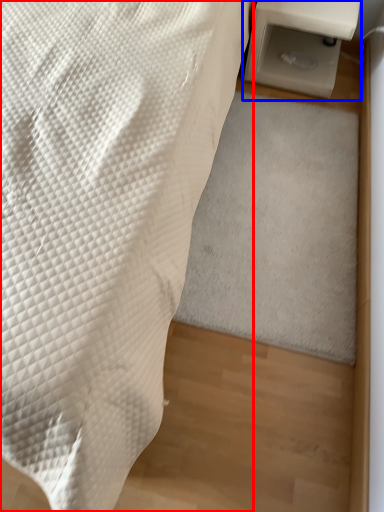
Question: Which object is further to the camera taking this photo, furniture (highlighted by a red box) or table (highlighted by a blue box)?

Choices:
 (A) furniture
 (B) table

Answer: (B)